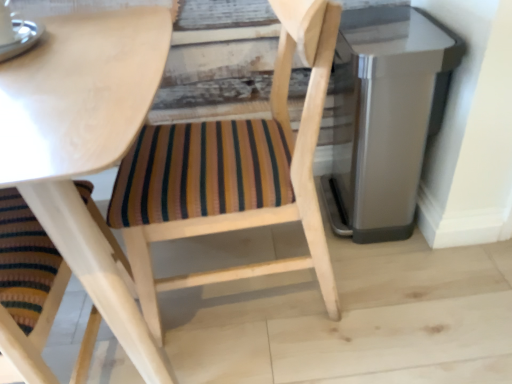
Locate an element on the screen. This screenshot has width=512, height=384. vacant region in front of satin silver trash can at right is located at coordinates (433, 295).